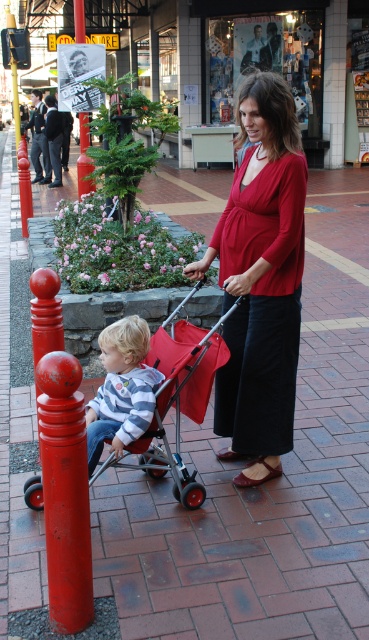
Question: Estimate the real-world distances between objects in this image. Which object is farther from the matte red blouse at center?

Choices:
 (A) metallic red pole at left
 (B) matte red stroller at center

Answer: (A)

Question: Is matte red stroller at center to the right of metallic red pole at left from the viewer's perspective?

Choices:
 (A) no
 (B) yes

Answer: (B)

Question: Which is nearer to the matte red stroller at center?

Choices:
 (A) matte red blouse at center
 (B) metallic red pole at left
 (C) striped cotton shirt at center

Answer: (C)

Question: Does matte red stroller at center come behind striped cotton shirt at center?

Choices:
 (A) no
 (B) yes

Answer: (B)

Question: Observing the image, what is the correct spatial positioning of striped cotton shirt at center in reference to metallic red pole at left?

Choices:
 (A) left
 (B) right

Answer: (B)

Question: Among these points, which one is farthest from the camera?

Choices:
 (A) (81, 145)
 (B) (218, 228)
 (C) (105, 362)

Answer: (A)